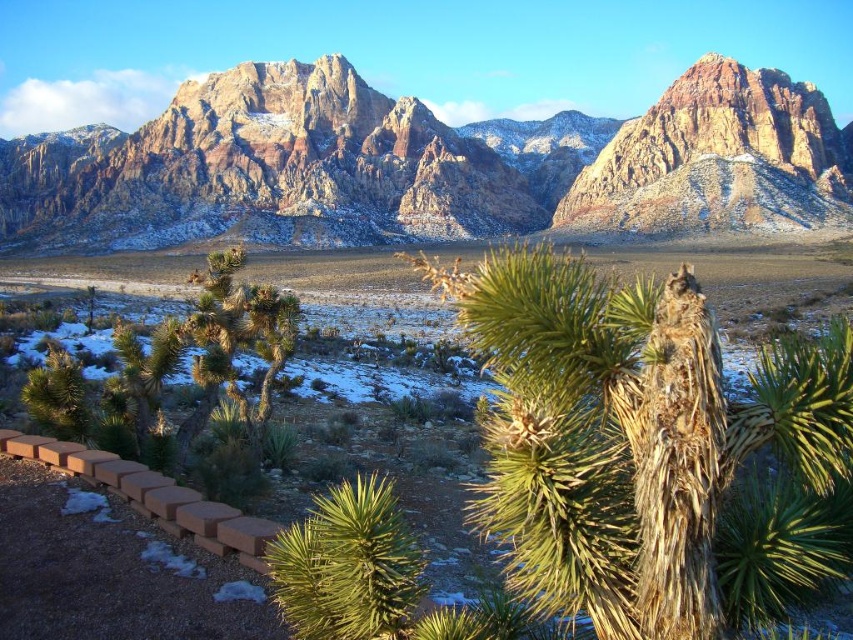
You are standing in the desert and want to take a photo of the rugged sandstone mountains at upper center and the green spiky palm tree at lower center. Which object appears closer to you in the photo?

The green spiky palm tree at lower center appears closer because it is positioned below the rugged sandstone mountains at upper center, which are further away in the scene.

You are a hiker planning to take a photo of both the rugged sandstone mountains at upper center and the green spiky palm tree at lower center. Which object should you position closer to the edge of your camera frame to ensure both fit in the shot?

To ensure both the rugged sandstone mountains at upper center and the green spiky palm tree at lower center fit in the shot, position the green spiky palm tree at lower center closer to the edge of your camera frame since the rugged sandstone mountains at upper center are wider.

You are a hiker planning to traverse the desert landscape shown in the image. You need to reach the base of the rugged sandstone mountains at upper center from the green spiky palm tree at lower center. Given that your water supply can only sustain you for a 0.5 mile hike, will you be able to complete the journey without needing additional water?

The rugged sandstone mountains at upper center and green spiky palm tree at lower center are 617.61 feet apart. Since 617.61 feet is approximately 0.116 miles, which is less than 0.5 miles, you can complete the journey without needing additional water.